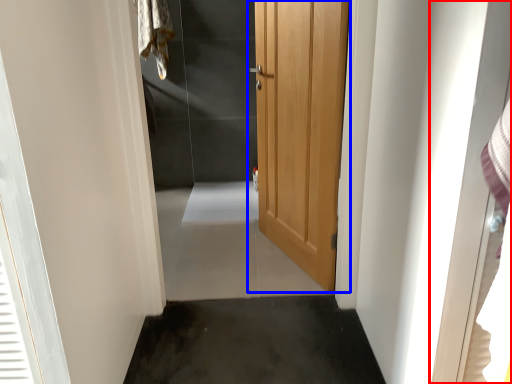
Question: Which point is further to the camera, screen door (highlighted by a red box) or door (highlighted by a blue box)?

Choices:
 (A) screen door
 (B) door

Answer: (B)